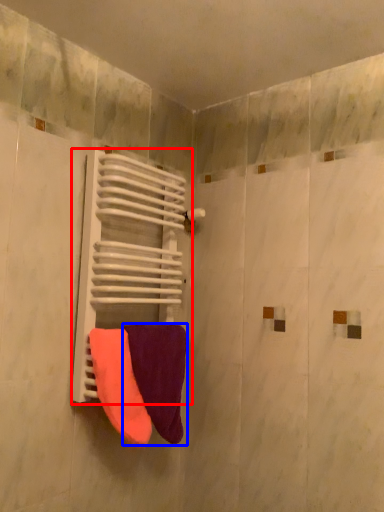
Question: Which point is further to the camera, radiator (highlighted by a red box) or towel (highlighted by a blue box)?

Choices:
 (A) radiator
 (B) towel

Answer: (B)